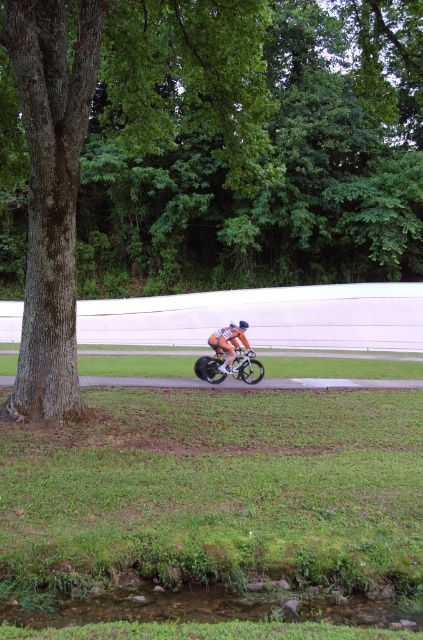
You are a photographer positioned to the front of the cyclist. You want to capture a clear shot of the orange reflective suit at center without the green rough bark tree at left blocking the view. Based on their positions, is this possible?

The green rough bark tree at left is located above the orange reflective suit at center, so if you are positioned in front of the cyclist, the tree would not block the view of the suit since it is above it.

You are a photographer trying to capture the cyclist in the orange reflective suit at center. You want to ensure the green rough bark tree at left doesn not block the view. Can you determine if the tree is wider than the cyclist?

The green rough bark tree at left is wider than the orange reflective suit at center, so the tree may block the view of the cyclist if positioned too closely.